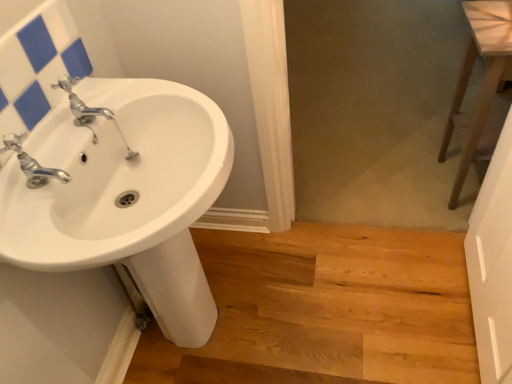
What do you see at coordinates (122, 192) in the screenshot? The image size is (512, 384). I see `white glossy sink at left` at bounding box center [122, 192].

I want to click on chrome metallic faucet at upper left, so click(88, 111).

Locate an element on the screen. The height and width of the screenshot is (384, 512). white glossy sink at upper left is located at coordinates (37, 65).

From the image's perspective, relative to transparent glass screen door at right, is brown wooden stool at right above or below?

Based on their image positions, brown wooden stool at right is located above transparent glass screen door at right.

Is brown wooden stool at right not within transparent glass screen door at right?

brown wooden stool at right is positioned outside transparent glass screen door at right.

Between brown wooden stool at right and transparent glass screen door at right, which one has larger size?

brown wooden stool at right is bigger.

From a real-world perspective, which is physically below, brown wooden stool at right or transparent glass screen door at right?

brown wooden stool at right, from a real-world perspective.

Is chrome metallic faucet at upper left not within white glossy sink at upper left?

That's correct, chrome metallic faucet at upper left is outside of white glossy sink at upper left.

Which is closer, (75, 99) or (78, 53)?

The point (75, 99) is more forward.

From a real-world perspective, relative to white glossy sink at upper left, is chrome metallic faucet at upper left vertically above or below?

From a real-world perspective, chrome metallic faucet at upper left is physically below white glossy sink at upper left.

Between point (277, 289) and point (134, 275), which one is positioned behind?

The point (277, 289) is behind.

From a real-world perspective, does light brown wood at lower center stand above white glossy sink at left?

No.

Is light brown wood at lower center thinner than white glossy sink at left?

In fact, light brown wood at lower center might be wider than white glossy sink at left.

Consider the image. From the image's perspective, between transparent glass screen door at right and light brown wood at lower center, which one is located above?

From the image's view, transparent glass screen door at right is above.

How far apart are transparent glass screen door at right and light brown wood at lower center?

A distance of 15.08 inches exists between transparent glass screen door at right and light brown wood at lower center.

Can you confirm if transparent glass screen door at right is wider than light brown wood at lower center?

In fact, transparent glass screen door at right might be narrower than light brown wood at lower center.

Is there a large distance between transparent glass screen door at right and light brown wood at lower center?

No, transparent glass screen door at right is not far away from light brown wood at lower center.

From the image's perspective, between white glossy sink at left and brown wooden stool at right, which one is located above?

brown wooden stool at right appears higher in the image.

Considering the sizes of objects white glossy sink at left and brown wooden stool at right in the image provided, who is taller, white glossy sink at left or brown wooden stool at right?

Standing taller between the two is white glossy sink at left.

Identify the location of level behind the white glossy sink at left. This screenshot has height=384, width=512. click(483, 84).

Does white glossy sink at upper left contain transparent glass screen door at right?

Definitely not — transparent glass screen door at right is not inside white glossy sink at upper left.

Measure the distance between white glossy sink at upper left and transparent glass screen door at right.

The distance of white glossy sink at upper left from transparent glass screen door at right is 1.22 meters.

Is transparent glass screen door at right at the back of white glossy sink at upper left?

white glossy sink at upper left is not turned away from transparent glass screen door at right.

Identify the location of screen door on the right side of white glossy sink at upper left. (493, 263).

Can you confirm if transparent glass screen door at right is bigger than white glossy sink at upper left?

Indeed, transparent glass screen door at right has a larger size compared to white glossy sink at upper left.

Is transparent glass screen door at right placed right next to white glossy sink at upper left?

No, transparent glass screen door at right is not with white glossy sink at upper left.

Which object is closer to the camera taking this photo, transparent glass screen door at right or white glossy sink at upper left?

transparent glass screen door at right.

Find the location of `level located behind the transparent glass screen door at right`. level located behind the transparent glass screen door at right is located at coordinates (483, 84).

The image size is (512, 384). What are the coordinates of `mirror in front of the chrome metallic faucet at upper left` in the screenshot? It's located at (37, 65).

When comparing their distances from light brown wood at lower center, does chrome metallic faucet at upper left or white glossy sink at upper left seem closer?

Based on the image, chrome metallic faucet at upper left appears to be nearer to light brown wood at lower center.

Considering their positions, is chrome metallic faucet at upper left positioned further to silver metallic faucet at left than brown wooden stool at right?

brown wooden stool at right lies further to silver metallic faucet at left than the other object.

Which object lies further to the anchor point brown wooden stool at right, white glossy sink at left or transparent glass screen door at right?

white glossy sink at left is positioned further to the anchor brown wooden stool at right.

From the image, which object appears to be farther from white glossy sink at left, chrome metallic faucet at upper left or light brown wood at lower center?

Based on the image, light brown wood at lower center appears to be further to white glossy sink at left.

Considering their positions, is light brown wood at lower center positioned further to brown wooden stool at right than chrome metallic faucet at upper left?

chrome metallic faucet at upper left is further to brown wooden stool at right.

Which object lies nearer to the anchor point chrome metallic faucet at upper left, silver metallic faucet at left or transparent glass screen door at right?

silver metallic faucet at left.

In the scene shown: Looking at the image, which one is located closer to transparent glass screen door at right, white glossy sink at left or light brown wood at lower center?

Based on the image, light brown wood at lower center appears to be nearer to transparent glass screen door at right.

Considering their positions, is light brown wood at lower center positioned further to white glossy sink at left than silver metallic faucet at left?

light brown wood at lower center.

Where is `sink located between chrome metallic faucet at upper left and brown wooden stool at right in the left-right direction`? sink located between chrome metallic faucet at upper left and brown wooden stool at right in the left-right direction is located at coordinates (122, 192).

Identify the location of stairwell between silver metallic faucet at left and transparent glass screen door at right. coord(326,310).

Image resolution: width=512 pixels, height=384 pixels. Find the location of `stairwell located between white glossy sink at left and transparent glass screen door at right in the left-right direction`. stairwell located between white glossy sink at left and transparent glass screen door at right in the left-right direction is located at coordinates click(326, 310).

The height and width of the screenshot is (384, 512). I want to click on sink between white glossy sink at upper left and light brown wood at lower center from left to right, so click(x=122, y=192).